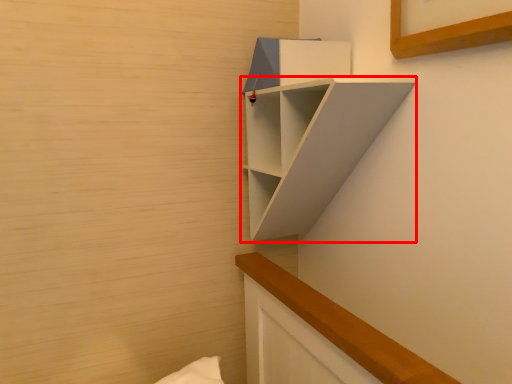
Question: From the image's perspective, considering the relative positions of shelf (annotated by the red box) and cabinet in the image provided, where is shelf (annotated by the red box) located with respect to the staircase?

Choices:
 (A) below
 (B) above

Answer: (A)